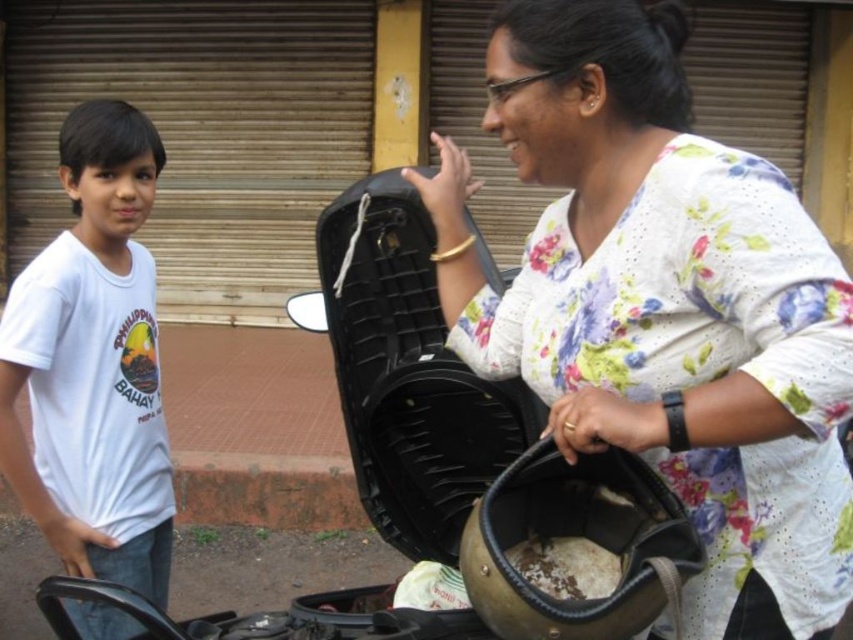
Does point (827, 552) come in front of point (90, 192)?

Yes, point (827, 552) is in front of point (90, 192).

Does floral cotton shirt at center appear on the right side of white cotton t-shirt at left?

Yes, floral cotton shirt at center is to the right of white cotton t-shirt at left.

Is point (704, 499) farther from viewer compared to point (141, 442)?

No, it is in front of (141, 442).

This screenshot has height=640, width=853. Identify the location of floral cotton shirt at center. (665, 305).